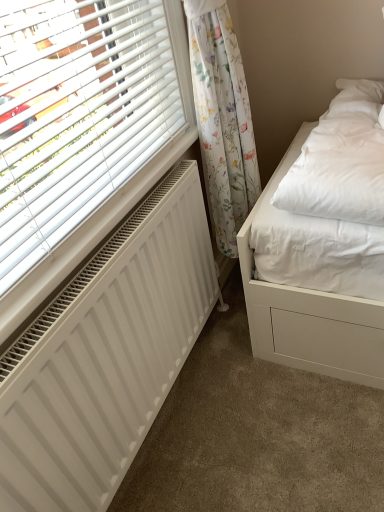
Locate an element on the screen. Image resolution: width=384 pixels, height=512 pixels. vacant area situated below white matte radiator at lower left (from a real-world perspective) is located at coordinates (167, 423).